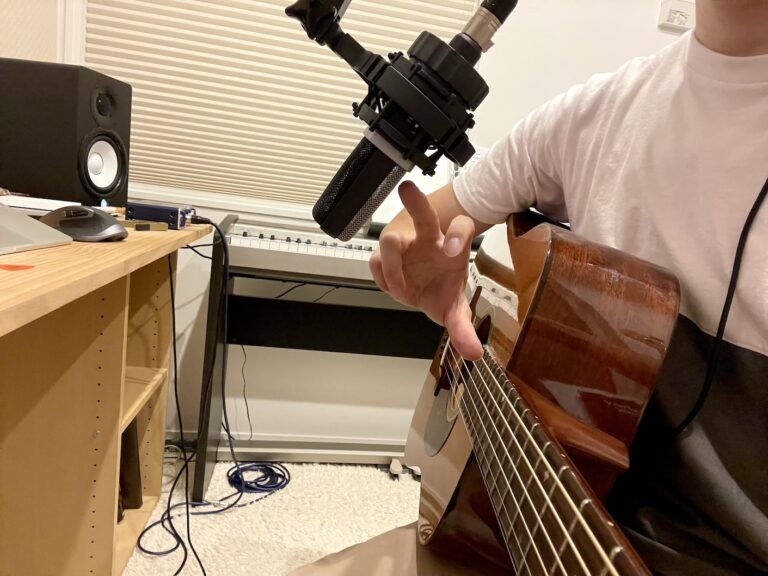
The image size is (768, 576). In order to click on speaker in this screenshot , I will do `click(65, 139)`.